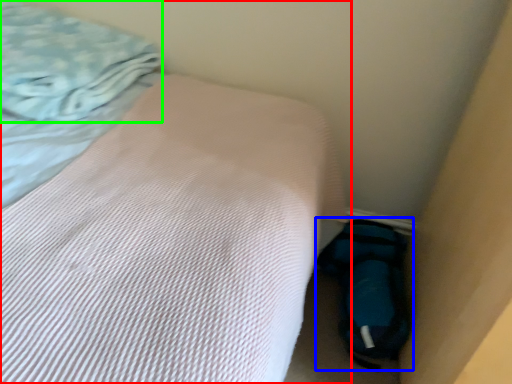
Question: Considering the real-world distances, which object is farthest from bed (highlighted by a red box)? sleeping bag (highlighted by a blue box) or blanket (highlighted by a green box)?

Choices:
 (A) sleeping bag
 (B) blanket

Answer: (A)